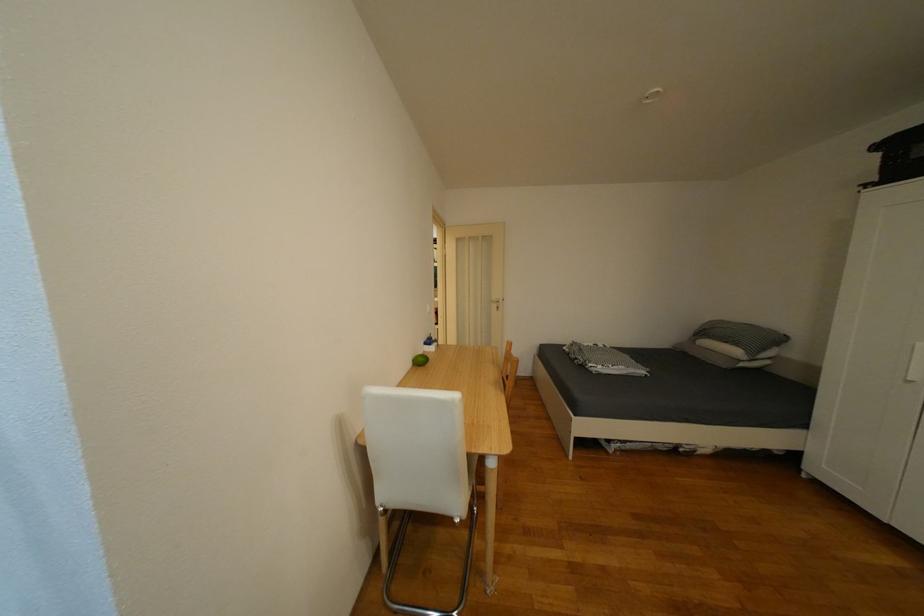
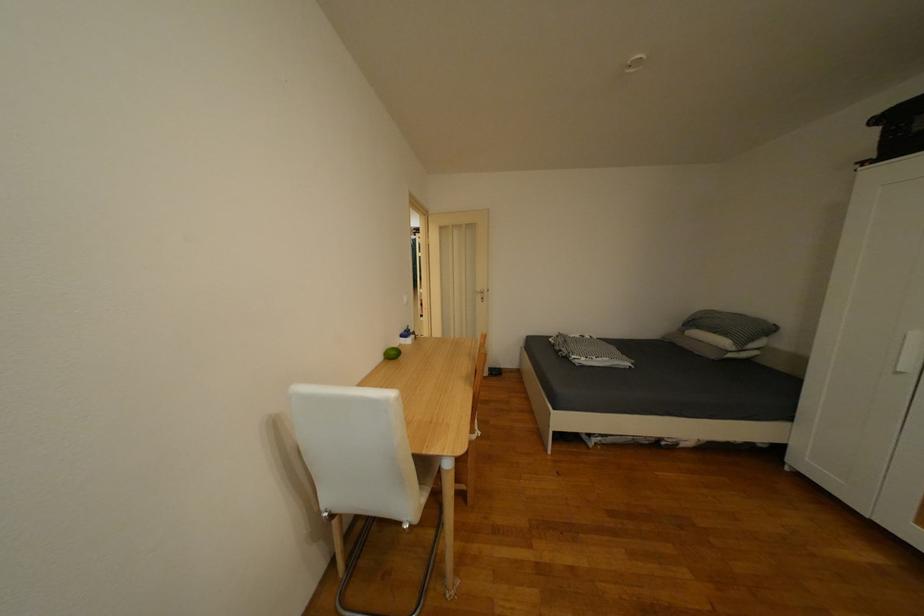
Question: How did the camera likely rotate?

Choices:
 (A) Left
 (B) Right
 (C) Up
 (D) Down

Answer: (D)